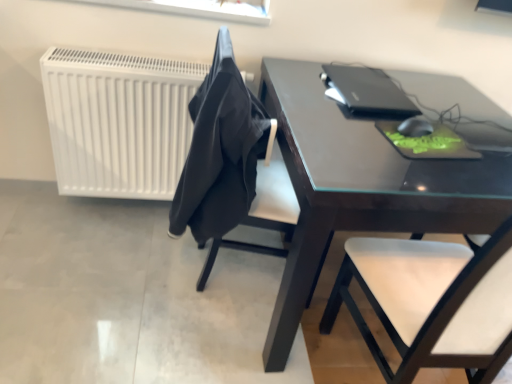
This screenshot has height=384, width=512. Find the location of `vacant space underneath black fabric at center (from a real-world perspective)`. vacant space underneath black fabric at center (from a real-world perspective) is located at coordinates point(179,262).